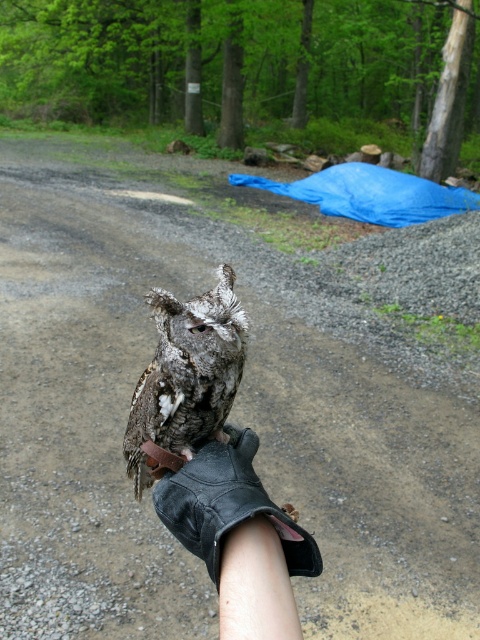
You are a photographer aiming to capture a clear photo of the speckled feathered owl at center while holding it on your black leather glove at center. Since the owl is larger than the glove, where should you position your camera to ensure both the owl and the glove are fully visible in the frame?

The black leather glove at center is shorter than the speckled feathered owl at center. To capture both in the frame, position the camera slightly above and centered to include the entire owl while still showing the glove underneath.

In the scene shown: You are a photographer trying to capture a closeup of the black leather glove at center and the speckled feathered owl at center. Which object is wider in the image?

The speckled feathered owl at center is wider than the black leather glove at center.